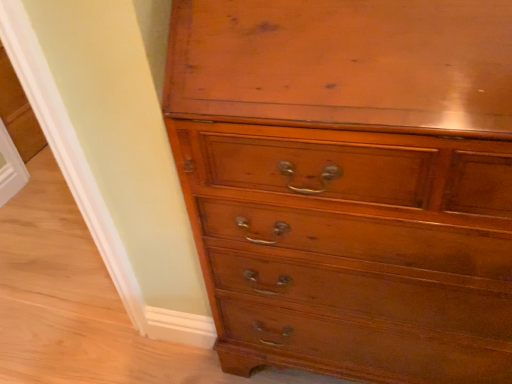
What do you see at coordinates (10, 167) in the screenshot? I see `white plastic screen door at lower left` at bounding box center [10, 167].

You are a GUI agent. You are given a task and a screenshot of the screen. Output one action in this format:
    pyautogui.click(x=<x>, y=<y>)
    Task: Click on the white plastic screen door at lower left
    The width and height of the screenshot is (512, 384).
    Given the screenshot: What is the action you would take?
    pyautogui.click(x=10, y=167)

What do you see at coordinates (349, 183) in the screenshot? This screenshot has width=512, height=384. I see `shiny brown wood chest of drawers at center` at bounding box center [349, 183].

Measure the distance between point (x=497, y=240) and camera.

Point (x=497, y=240) is 24.25 inches from camera.

Locate an element on the screen. The width and height of the screenshot is (512, 384). shiny brown wood chest of drawers at center is located at coordinates (349, 183).

Locate an element on the screen. The image size is (512, 384). white plastic screen door at lower left is located at coordinates (10, 167).

Visually, is shiny brown wood chest of drawers at center positioned to the left or to the right of white plastic screen door at lower left?

Based on their positions, shiny brown wood chest of drawers at center is located to the right of white plastic screen door at lower left.

Is shiny brown wood chest of drawers at center behind white plastic screen door at lower left?

No, it is in front of white plastic screen door at lower left.

Which point is more forward, (x=259, y=53) or (x=11, y=144)?

The point (x=259, y=53) is closer.

From the image's perspective, which is below, shiny brown wood chest of drawers at center or white plastic screen door at lower left?

shiny brown wood chest of drawers at center.

From a real-world perspective, is shiny brown wood chest of drawers at center beneath white plastic screen door at lower left?

No, from a real-world perspective, shiny brown wood chest of drawers at center is not beneath white plastic screen door at lower left.

Can you confirm if shiny brown wood chest of drawers at center is thinner than white plastic screen door at lower left?

No, shiny brown wood chest of drawers at center is not thinner than white plastic screen door at lower left.

Can you confirm if shiny brown wood chest of drawers at center is taller than white plastic screen door at lower left?

Correct, shiny brown wood chest of drawers at center is much taller as white plastic screen door at lower left.

Considering the relative sizes of shiny brown wood chest of drawers at center and white plastic screen door at lower left in the image provided, is shiny brown wood chest of drawers at center smaller than white plastic screen door at lower left?

No, shiny brown wood chest of drawers at center is not smaller than white plastic screen door at lower left.

Would you say shiny brown wood chest of drawers at center contains white plastic screen door at lower left?

No, white plastic screen door at lower left is not a part of shiny brown wood chest of drawers at center.

Are shiny brown wood chest of drawers at center and white plastic screen door at lower left located far from each other?

Yes, shiny brown wood chest of drawers at center and white plastic screen door at lower left are quite far apart.

Is shiny brown wood chest of drawers at center oriented away from white plastic screen door at lower left?

No, shiny brown wood chest of drawers at center is not facing away from white plastic screen door at lower left.

Measure the distance between shiny brown wood chest of drawers at center and white plastic screen door at lower left.

shiny brown wood chest of drawers at center and white plastic screen door at lower left are 1.38 meters apart.

Where is `screen door on the left of shiny brown wood chest of drawers at center`? screen door on the left of shiny brown wood chest of drawers at center is located at coordinates (10, 167).

In the image, is white plastic screen door at lower left on the left side or the right side of shiny brown wood chest of drawers at center?

white plastic screen door at lower left is positioned on shiny brown wood chest of drawers at center's left side.

Considering the positions of objects white plastic screen door at lower left and shiny brown wood chest of drawers at center in the image provided, who is behind, white plastic screen door at lower left or shiny brown wood chest of drawers at center?

white plastic screen door at lower left.

Does point (23, 166) come in front of point (425, 36)?

No, it is not.

From the image's perspective, which is below, white plastic screen door at lower left or shiny brown wood chest of drawers at center?

shiny brown wood chest of drawers at center.

From a real-world perspective, between white plastic screen door at lower left and shiny brown wood chest of drawers at center, who is vertically lower?

white plastic screen door at lower left.

Is white plastic screen door at lower left wider than shiny brown wood chest of drawers at center?

Incorrect, the width of white plastic screen door at lower left does not surpass that of shiny brown wood chest of drawers at center.

Considering the relative sizes of white plastic screen door at lower left and shiny brown wood chest of drawers at center in the image provided, is white plastic screen door at lower left shorter than shiny brown wood chest of drawers at center?

Correct, white plastic screen door at lower left is not as tall as shiny brown wood chest of drawers at center.

Between white plastic screen door at lower left and shiny brown wood chest of drawers at center, which one has smaller size?

white plastic screen door at lower left is smaller.

Is white plastic screen door at lower left situated inside shiny brown wood chest of drawers at center or outside?

white plastic screen door at lower left is spatially situated outside shiny brown wood chest of drawers at center.

Looking at this image, is white plastic screen door at lower left far from shiny brown wood chest of drawers at center?

Yes, white plastic screen door at lower left is far from shiny brown wood chest of drawers at center.

Is white plastic screen door at lower left oriented away from shiny brown wood chest of drawers at center?

No, white plastic screen door at lower left's orientation is not away from shiny brown wood chest of drawers at center.

Measure the distance between white plastic screen door at lower left and shiny brown wood chest of drawers at center.

They are 1.38 meters apart.

Locate an element on the screen. Image resolution: width=512 pixels, height=384 pixels. the chest of drawers positioned vertically above the white plastic screen door at lower left (from a real-world perspective) is located at coordinates (349, 183).

Where is `the chest of drawers lying below the white plastic screen door at lower left (from the image's perspective)`? Image resolution: width=512 pixels, height=384 pixels. the chest of drawers lying below the white plastic screen door at lower left (from the image's perspective) is located at coordinates (349, 183).

Locate an element on the screen. The height and width of the screenshot is (384, 512). the chest of drawers located in front of the white plastic screen door at lower left is located at coordinates (349, 183).